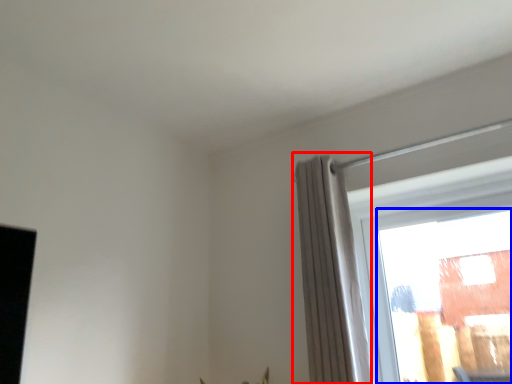
Question: Which object appears closest to the camera in this image, curtain (highlighted by a red box) or window (highlighted by a blue box)?

Choices:
 (A) curtain
 (B) window

Answer: (A)